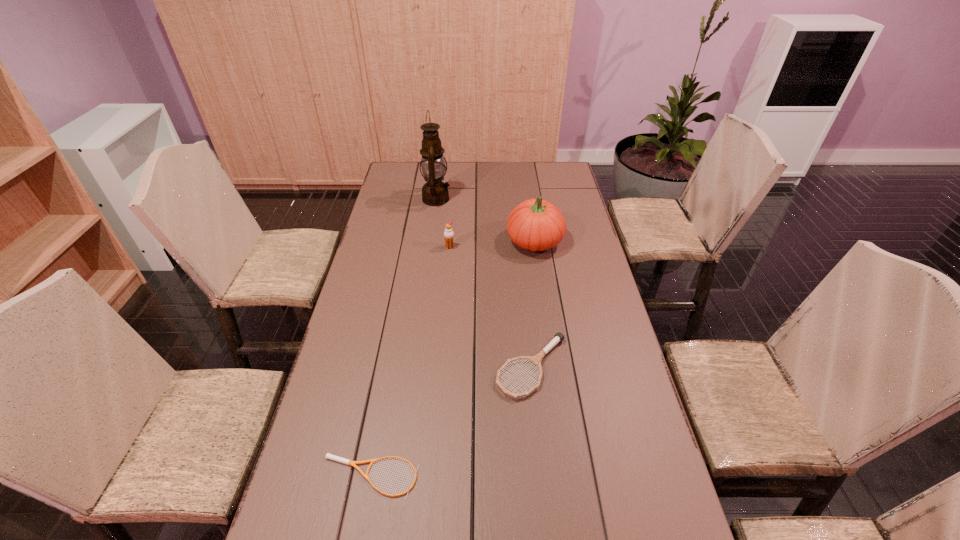
The width and height of the screenshot is (960, 540). Identify the location of free space between the second shortest object and the nearer tennis racket. (451, 422).

You are a GUI agent. You are given a task and a screenshot of the screen. Output one action in this format:
    pyautogui.click(x=<x>, y=<y>)
    Task: Click on the empty space that is in between the oil lamp and the right tennis racket
    
    Given the screenshot: What is the action you would take?
    pyautogui.click(x=484, y=283)

In order to click on vacant space that's between the taller tennis racket and the third tallest object in this screenshot , I will do `click(491, 307)`.

This screenshot has width=960, height=540. What are the coordinates of `free space between the farthest object and the icecream` in the screenshot? It's located at (443, 223).

Image resolution: width=960 pixels, height=540 pixels. Identify the location of vacant area that lies between the third tallest object and the tallest object. (443, 223).

Locate an element on the screen. free space between the fourth shortest object and the third tallest object is located at coordinates (492, 244).

The width and height of the screenshot is (960, 540). Identify the location of free area in between the farther tennis racket and the icecream. (491, 307).

Locate an element on the screen. The image size is (960, 540). vacant area that lies between the second tallest object and the second nearest object is located at coordinates (533, 304).

You are a GUI agent. You are given a task and a screenshot of the screen. Output one action in this format:
    pyautogui.click(x=<x>, y=<y>)
    Task: Click on the vacant area between the nearest object and the pumpkin
    
    Given the screenshot: What is the action you would take?
    pyautogui.click(x=452, y=359)

The height and width of the screenshot is (540, 960). I want to click on object that is the third closest to the pumpkin, so click(559, 337).